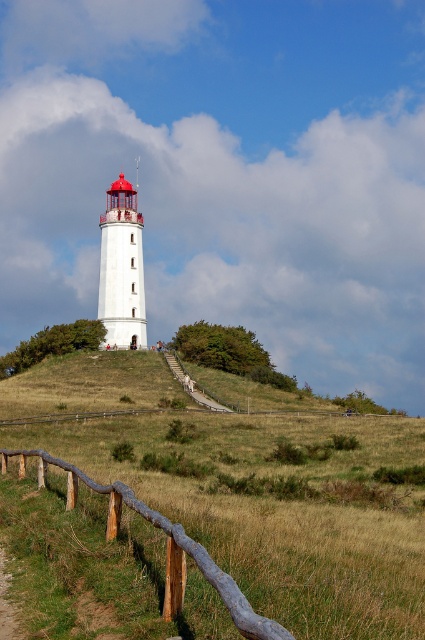
Is grassy hillside at center behind white matte lighthouse at center?

No.

Is point (96, 378) more distant than point (107, 241)?

No, (96, 378) is closer to viewer.

Find the location of `grassy hillside at center`. grassy hillside at center is located at coordinates (88, 384).

Who is positioned more to the left, grassy hillside at center or rustic wooden fence at lower left?

rustic wooden fence at lower left is more to the left.

Does grassy hillside at center appear on the right side of rustic wooden fence at lower left?

Indeed, grassy hillside at center is positioned on the right side of rustic wooden fence at lower left.

You are a GUI agent. You are given a task and a screenshot of the screen. Output one action in this format:
    pyautogui.click(x=<x>, y=<y>)
    Task: Click on the grassy hillside at center
    
    Given the screenshot: What is the action you would take?
    pyautogui.click(x=88, y=384)

The height and width of the screenshot is (640, 425). What are the coordinates of `grassy hillside at center` in the screenshot? It's located at (88, 384).

From the picture: Between white matte lighthouse at center and wooden stairs at center, which one appears on the left side from the viewer's perspective?

white matte lighthouse at center is more to the left.

Who is more forward, (113, 330) or (181, 376)?

Point (181, 376) is in front.

Which is behind, point (124, 193) or point (172, 368)?

The point (124, 193) is more distant.

Identify the location of white matte lighthouse at center. This screenshot has height=640, width=425. (121, 269).